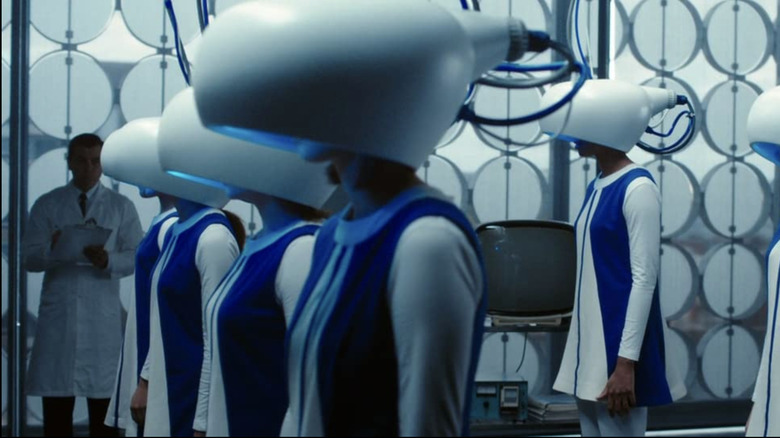
What are the coordinates of `clipboard` in the screenshot? It's located at (76, 238).